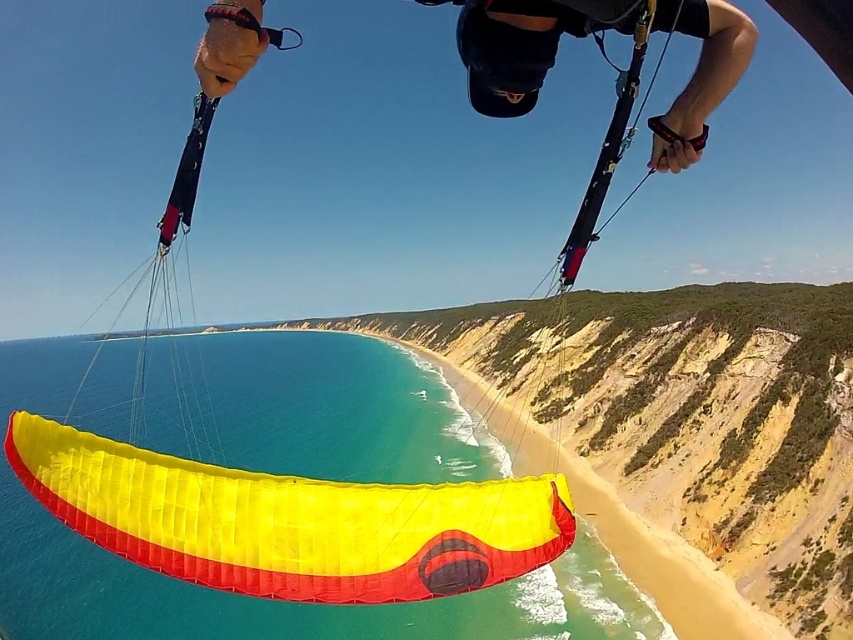
Is yellow fabric parasail at lower center smaller than black matte helmet at upper center?

No.

Who is shorter, yellow fabric parasail at lower center or black matte helmet at upper center?

With less height is black matte helmet at upper center.

From the picture: Who is more distant from viewer, [413,504] or [231,26]?

Positioned behind is point [413,504].

The image size is (853, 640). I want to click on yellow fabric parasail at lower center, so click(x=289, y=522).

Which is behind, point (148, 525) or point (509, 8)?

Point (148, 525)

Does point (254, 579) lie behind point (514, 76)?

Yes, it is.

Which is behind, point (277, 579) or point (241, 1)?

Point (277, 579)

Image resolution: width=853 pixels, height=640 pixels. In order to click on yellow fabric parachute at center in this screenshot , I will do `click(289, 522)`.

Is yellow fabric parachute at center shorter than yellow fabric parasail at lower center?

Incorrect, yellow fabric parachute at center's height does not fall short of yellow fabric parasail at lower center's.

Who is more forward, (x=125, y=444) or (x=45, y=467)?

Point (x=45, y=467) is in front.

Find the location of `yellow fabric parachute at center`. yellow fabric parachute at center is located at coordinates (289, 522).